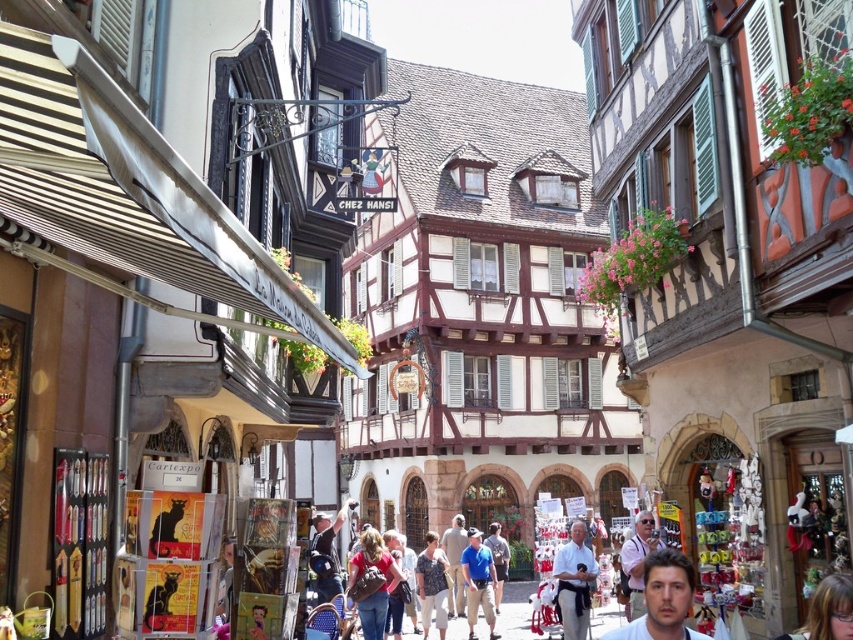
Question: Estimate the real-world distances between objects in this image. Which object is closer to the light blue shirt at center?

Choices:
 (A) smooth skin face at center
 (B) blue denim shorts at center
 (C) blue denim jeans at center
 (D) light brown leather jacket at center

Answer: (D)

Question: Which point appears farthest from the camera in this image?

Choices:
 (A) [425, 598]
 (B) [653, 516]
 (C) [378, 595]

Answer: (A)

Question: Is light blue shirt at center to the left of blue denim jeans at center from the viewer's perspective?

Choices:
 (A) no
 (B) yes

Answer: (A)

Question: Which is nearer to the light blue shirt at center?

Choices:
 (A) blue denim shorts at center
 (B) blue denim jeans at center
 (C) light brown fabric shirt at center
 (D) light brown leather jacket at center

Answer: (D)

Question: Observing the image, what is the correct spatial positioning of denim jeans at center in reference to light brown fabric shirt at center?

Choices:
 (A) right
 (B) left

Answer: (B)

Question: Does smooth skin face at center appear on the right side of blue cotton shirt at center?

Choices:
 (A) yes
 (B) no

Answer: (A)